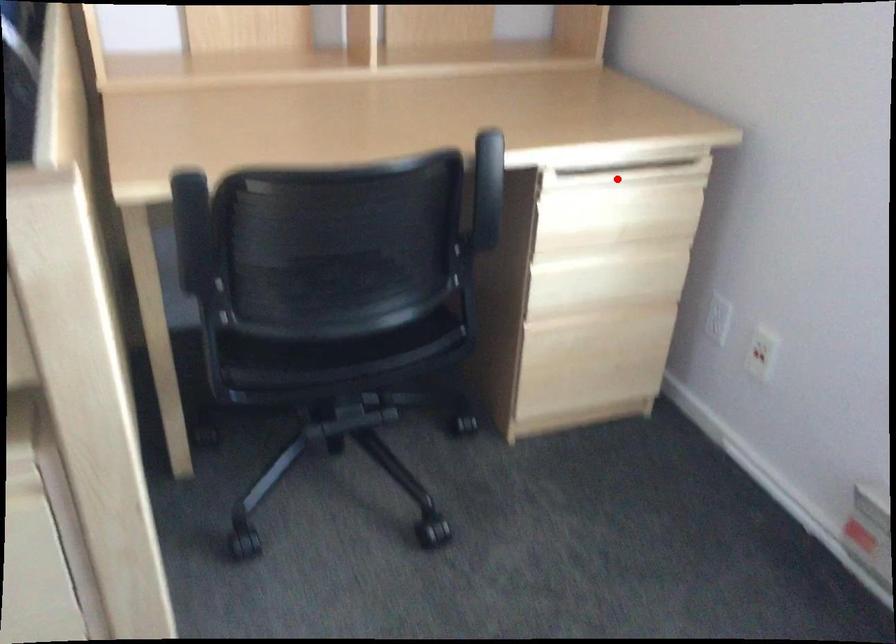
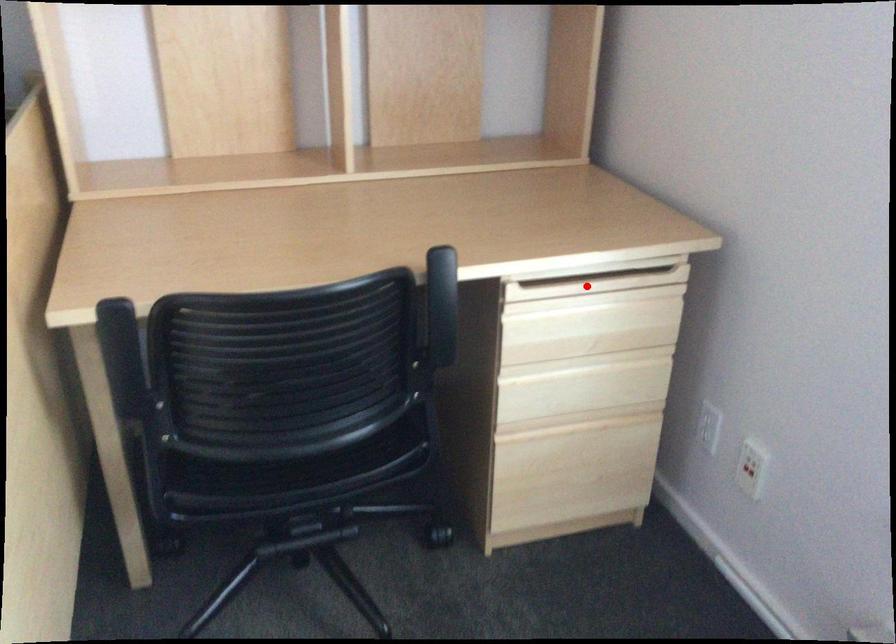
I am providing you with two images of the same scene from different viewpoints. A red point is marked on the first image and another point is marked on the second image. Does the point marked in image1 correspond to the same location as the one in image2?

Yes